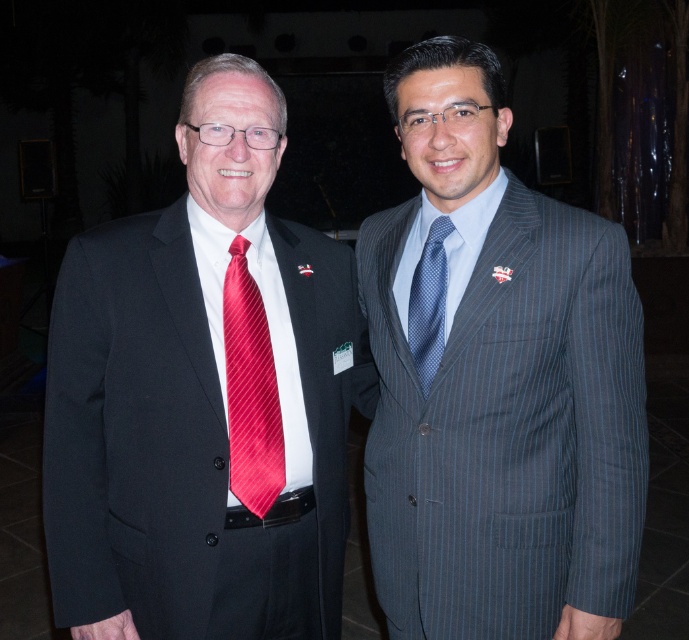
Who is taller, blue pinstripe suit at center or matte black suit at left?

blue pinstripe suit at center is taller.

Is point (398, 248) in front of point (240, 132)?

No, it is not.

At what (x,y) coordinates should I click in order to perform the action: click on blue pinstripe suit at center. Please return your answer as a coordinate pair (x, y). Looking at the image, I should click on (495, 380).

Which is behind, point (245, 218) or point (440, 292)?

The point (440, 292) is behind.

Describe the element at coordinates (200, 403) in the screenshot. I see `matte black suit at left` at that location.

The image size is (689, 640). Describe the element at coordinates (200, 403) in the screenshot. I see `matte black suit at left` at that location.

The height and width of the screenshot is (640, 689). In order to click on matte black suit at left in this screenshot , I will do `click(200, 403)`.

Can you confirm if blue pinstripe suit at center is positioned above shiny red tie at center?

Yes.

The image size is (689, 640). I want to click on blue pinstripe suit at center, so click(x=495, y=380).

Does point (511, 532) lie in front of point (243, 301)?

Yes, point (511, 532) is closer to viewer.

Locate an element on the screen. Image resolution: width=689 pixels, height=640 pixels. blue pinstripe suit at center is located at coordinates (495, 380).